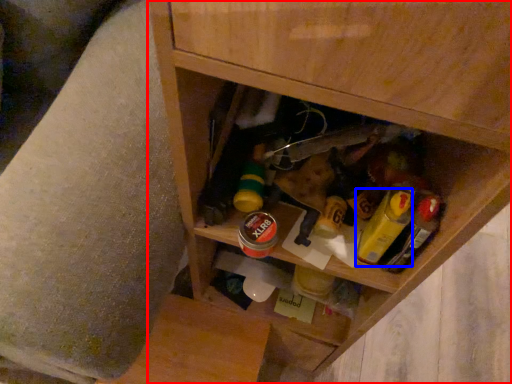
Question: Which point is further to the camera, cabinetry (highlighted by a red box) or mustard (highlighted by a blue box)?

Choices:
 (A) cabinetry
 (B) mustard

Answer: (B)